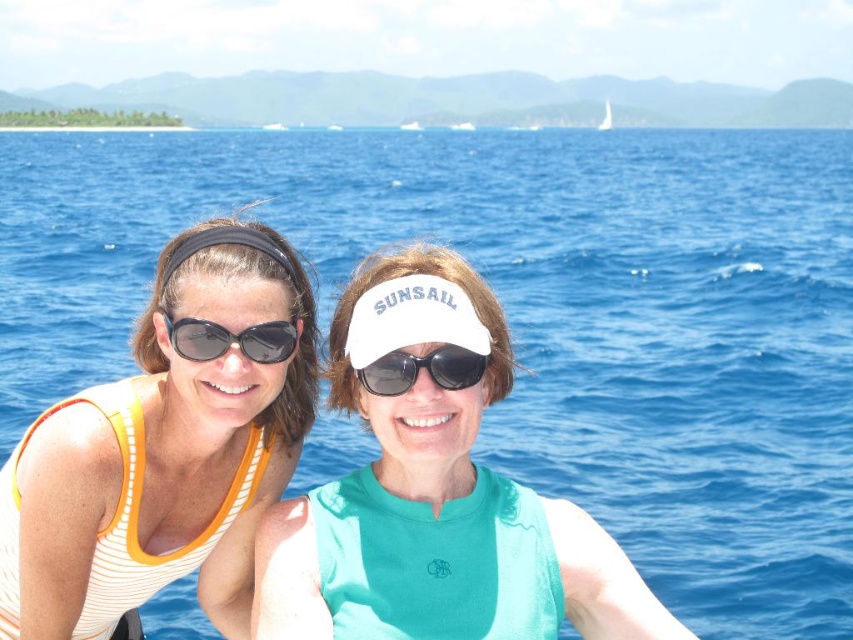
Is matte black sunglasses at center positioned at the back of black matte sunglasses at center?

No.

Between matte black sunglasses at center and black matte sunglasses at center, which one has less height?

black matte sunglasses at center

You are a GUI agent. You are given a task and a screenshot of the screen. Output one action in this format:
    pyautogui.click(x=<x>, y=<y>)
    Task: Click on the matte black sunglasses at center
    This screenshot has width=853, height=640.
    Given the screenshot: What is the action you would take?
    pyautogui.click(x=231, y=339)

Is teal fabric visor at center shorter than black matte sunglasses at center?

Yes, teal fabric visor at center is shorter than black matte sunglasses at center.

Between teal fabric visor at center and black matte sunglasses at center, which one is positioned lower?

Answer: teal fabric visor at center

The width and height of the screenshot is (853, 640). I want to click on teal fabric visor at center, so click(436, 497).

Who is more distant from viewer, (186,420) or (438,348)?

The point (186,420) is more distant.

Locate an element on the screen. This screenshot has height=640, width=853. white striped tank top at left is located at coordinates (166, 444).